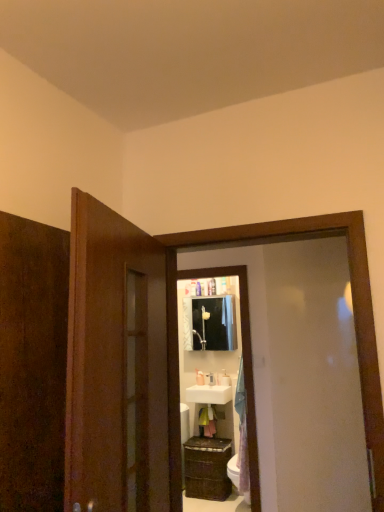
I want to click on white glossy sink at center, so click(209, 394).

The height and width of the screenshot is (512, 384). What do you see at coordinates (210, 323) in the screenshot?
I see `matte white medicine cabinet at center` at bounding box center [210, 323].

Where is `white glossy toothbrush at upper center, which is counted as the third toiletry, starting from the left`? The height and width of the screenshot is (512, 384). white glossy toothbrush at upper center, which is counted as the third toiletry, starting from the left is located at coordinates (225, 378).

This screenshot has width=384, height=512. What do you see at coordinates (225, 378) in the screenshot?
I see `white glossy toothbrush at upper center, which is counted as the third toiletry, starting from the left` at bounding box center [225, 378].

Locate an element on the screen. Image resolution: width=384 pixels, height=512 pixels. white glossy toilet bowl at lower right is located at coordinates (234, 472).

Is white glossy toilet bowl at lower right next to white glossy toothbrush at upper center, the first toiletry in the right-to-left sequence?

They are not placed beside each other.

Based on their sizes in the image, would you say white glossy toilet bowl at lower right is bigger or smaller than white glossy toothbrush at upper center, which is counted as the third toiletry, starting from the left?

white glossy toilet bowl at lower right is bigger than white glossy toothbrush at upper center, which is counted as the third toiletry, starting from the left.

What's the angular difference between white glossy toilet bowl at lower right and white glossy toothbrush at upper center, the first toiletry in the right-to-left sequence,'s facing directions?

The angular difference between white glossy toilet bowl at lower right and white glossy toothbrush at upper center, the first toiletry in the right-to-left sequence, is 4.81 degrees.

Is white glossy toilet bowl at lower right positioned with its back to white glossy toothbrush at upper center, the first toiletry in the right-to-left sequence?

No, white glossy toilet bowl at lower right is not facing the opposite direction of white glossy toothbrush at upper center, the first toiletry in the right-to-left sequence.

Can you confirm if white glossy soap dispenser at center, the 1th toiletry in the left-to-right sequence, is thinner than matte white medicine cabinet at center?

Indeed, white glossy soap dispenser at center, the 1th toiletry in the left-to-right sequence, has a lesser width compared to matte white medicine cabinet at center.

Measure the distance between white glossy soap dispenser at center, the 1th toiletry in the left-to-right sequence, and matte white medicine cabinet at center.

white glossy soap dispenser at center, the 1th toiletry in the left-to-right sequence, is 59.76 centimeters away from matte white medicine cabinet at center.

From the image's perspective, is white glossy soap dispenser at center, acting as the 3th toiletry starting from the right, on matte white medicine cabinet at center?

No, from the image's perspective, white glossy soap dispenser at center, acting as the 3th toiletry starting from the right, is not on top of matte white medicine cabinet at center.

Is white glossy toilet bowl at lower right completely or partially inside white glossy soap dispenser at center, acting as the second toiletry starting from the right?

No, white glossy toilet bowl at lower right is not surrounded by white glossy soap dispenser at center, acting as the second toiletry starting from the right.

In terms of size, does white glossy soap dispenser at center, acting as the second toiletry starting from the right, appear bigger or smaller than white glossy toilet bowl at lower right?

Considering their sizes, white glossy soap dispenser at center, acting as the second toiletry starting from the right, takes up less space than white glossy toilet bowl at lower right.

From the image's perspective, between white glossy soap dispenser at center, placed as the second toiletry when sorted from left to right, and white glossy toilet bowl at lower right, who is located below?

white glossy toilet bowl at lower right appears lower in the image.

Could you tell me if white glossy soap dispenser at center, acting as the second toiletry starting from the right, is turned towards white glossy sink at center?

No, white glossy soap dispenser at center, acting as the second toiletry starting from the right, is not facing towards white glossy sink at center.

Between white glossy soap dispenser at center, acting as the second toiletry starting from the right, and white glossy sink at center, which one appears on the right side from the viewer's perspective?

white glossy soap dispenser at center, acting as the second toiletry starting from the right.

Consider the image. From a real-world perspective, who is located lower, white glossy soap dispenser at center, placed as the second toiletry when sorted from left to right, or white glossy sink at center?

In real-world perspective, white glossy sink at center is lower.

Looking at this image, does white glossy soap dispenser at center, acting as the second toiletry starting from the right, touch white glossy sink at center?

white glossy soap dispenser at center, acting as the second toiletry starting from the right, and white glossy sink at center are not in contact.

Is white glossy toothbrush at upper center, the first toiletry in the right-to-left sequence, bigger than white glossy soap dispenser at center, acting as the 3th toiletry starting from the right?

Correct, white glossy toothbrush at upper center, the first toiletry in the right-to-left sequence, is larger in size than white glossy soap dispenser at center, acting as the 3th toiletry starting from the right.

From a real-world perspective, is white glossy toothbrush at upper center, the first toiletry in the right-to-left sequence, physically located above or below white glossy soap dispenser at center, acting as the 3th toiletry starting from the right?

Clearly, from a real-world perspective, white glossy toothbrush at upper center, the first toiletry in the right-to-left sequence, is below white glossy soap dispenser at center, acting as the 3th toiletry starting from the right.

Is white glossy toothbrush at upper center, the first toiletry in the right-to-left sequence, far from white glossy soap dispenser at center, acting as the 3th toiletry starting from the right?

Actually, white glossy toothbrush at upper center, the first toiletry in the right-to-left sequence, and white glossy soap dispenser at center, acting as the 3th toiletry starting from the right, are a little close together.

Considering the sizes of objects white glossy toothbrush at upper center, the first toiletry in the right-to-left sequence, and white glossy soap dispenser at center, acting as the 3th toiletry starting from the right, in the image provided, who is wider, white glossy toothbrush at upper center, the first toiletry in the right-to-left sequence, or white glossy soap dispenser at center, acting as the 3th toiletry starting from the right,?

Wider between the two is white glossy toothbrush at upper center, the first toiletry in the right-to-left sequence.

Is white glossy sink at center inside matte white medicine cabinet at center?

No, white glossy sink at center is not a part of matte white medicine cabinet at center.

Between matte white medicine cabinet at center and white glossy sink at center, which one appears on the right side from the viewer's perspective?

From the viewer's perspective, matte white medicine cabinet at center appears more on the right side.

From the picture: From the image's perspective, between matte white medicine cabinet at center and white glossy sink at center, who is located below?

white glossy sink at center appears lower in the image.

Based on the photo, looking at the image, does matte white medicine cabinet at center seem bigger or smaller compared to white glossy sink at center?

Considering their sizes, matte white medicine cabinet at center takes up more space than white glossy sink at center.

From a real-world perspective, which is physically below, white glossy soap dispenser at center, acting as the second toiletry starting from the right, or matte white medicine cabinet at center?

A: From a 3D spatial view, white glossy soap dispenser at center, acting as the second toiletry starting from the right, is below.

Measure the distance between white glossy soap dispenser at center, placed as the second toiletry when sorted from left to right, and matte white medicine cabinet at center.

white glossy soap dispenser at center, placed as the second toiletry when sorted from left to right, and matte white medicine cabinet at center are 24.46 inches apart from each other.

Considering the sizes of objects white glossy soap dispenser at center, placed as the second toiletry when sorted from left to right, and matte white medicine cabinet at center in the image provided, who is shorter, white glossy soap dispenser at center, placed as the second toiletry when sorted from left to right, or matte white medicine cabinet at center?

Standing shorter between the two is white glossy soap dispenser at center, placed as the second toiletry when sorted from left to right.

Image resolution: width=384 pixels, height=512 pixels. What are the coordinates of `toilet bowl lying below the white glossy toothbrush at upper center, which is counted as the third toiletry, starting from the left (from the image's perspective)` in the screenshot? It's located at (234, 472).

This screenshot has width=384, height=512. What are the coordinates of `medicine cabinet above the white glossy soap dispenser at center, the 1th toiletry in the left-to-right sequence (from a real-world perspective)` in the screenshot? It's located at (210, 323).

When comparing their distances from white glossy toilet bowl at lower right, does white glossy soap dispenser at center, placed as the second toiletry when sorted from left to right, or white glossy sink at center seem further?

Among the two, white glossy soap dispenser at center, placed as the second toiletry when sorted from left to right, is located further to white glossy toilet bowl at lower right.

Which object lies nearer to the anchor point matte white medicine cabinet at center, wooden cabinet at lower center or white glossy toilet bowl at lower right?

Among the two, wooden cabinet at lower center is located nearer to matte white medicine cabinet at center.

Considering their positions, is white glossy toothbrush at upper center, which is counted as the third toiletry, starting from the left, positioned further to white glossy soap dispenser at center, placed as the second toiletry when sorted from left to right, than white glossy toilet bowl at lower right?

white glossy toilet bowl at lower right lies further to white glossy soap dispenser at center, placed as the second toiletry when sorted from left to right, than the other object.

Based on their spatial positions, is white glossy sink at center or white glossy soap dispenser at center, acting as the second toiletry starting from the right, closer to white glossy toilet bowl at lower right?

Among the two, white glossy sink at center is located nearer to white glossy toilet bowl at lower right.

Consider the image. Looking at the image, which one is located closer to white glossy soap dispenser at center, acting as the 3th toiletry starting from the right, wooden cabinet at lower center or white glossy soap dispenser at center, acting as the second toiletry starting from the right?

Among the two, white glossy soap dispenser at center, acting as the second toiletry starting from the right, is located nearer to white glossy soap dispenser at center, acting as the 3th toiletry starting from the right.

Considering their positions, is white glossy toilet bowl at lower right positioned closer to white glossy soap dispenser at center, placed as the second toiletry when sorted from left to right, than white glossy soap dispenser at center, acting as the 3th toiletry starting from the right?

Among the two, white glossy soap dispenser at center, acting as the 3th toiletry starting from the right, is located nearer to white glossy soap dispenser at center, placed as the second toiletry when sorted from left to right.

Looking at the image, which one is located closer to white glossy soap dispenser at center, the 1th toiletry in the left-to-right sequence, white glossy toilet bowl at lower right or white glossy sink at center?

white glossy sink at center is positioned closer to the anchor white glossy soap dispenser at center, the 1th toiletry in the left-to-right sequence.

Estimate the real-world distances between objects in this image. Which object is further from white glossy sink at center, wooden cabinet at lower center or white glossy toothbrush at upper center, which is counted as the third toiletry, starting from the left?

wooden cabinet at lower center is positioned further to the anchor white glossy sink at center.

The width and height of the screenshot is (384, 512). In order to click on sink positioned between white glossy toilet bowl at lower right and white glossy toothbrush at upper center, the first toiletry in the right-to-left sequence, from near to far in this screenshot , I will do `click(209, 394)`.

At what (x,y) coordinates should I click in order to perform the action: click on toiletry between matte white medicine cabinet at center and white glossy soap dispenser at center, acting as the second toiletry starting from the right, vertically. Please return your answer as a coordinate pair (x, y). The image size is (384, 512). Looking at the image, I should click on (225, 378).

I want to click on sink between white glossy toilet bowl at lower right and white glossy soap dispenser at center, acting as the 3th toiletry starting from the right, in the front-back direction, so (209, 394).

The height and width of the screenshot is (512, 384). I want to click on sink between white glossy toilet bowl at lower right and white glossy soap dispenser at center, placed as the second toiletry when sorted from left to right, in the front-back direction, so click(x=209, y=394).